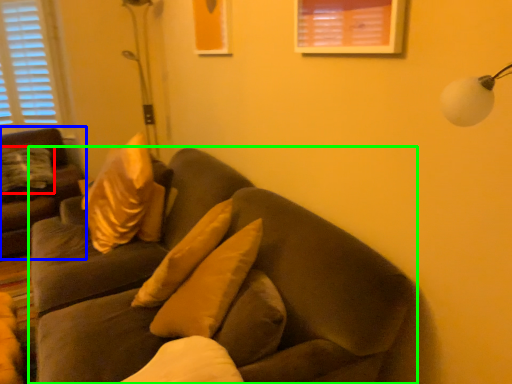
Question: Which is nearer to the pillow (highlighted by a red box)? studio couch (highlighted by a blue box) or studio couch (highlighted by a green box).

Choices:
 (A) studio couch
 (B) studio couch

Answer: (A)